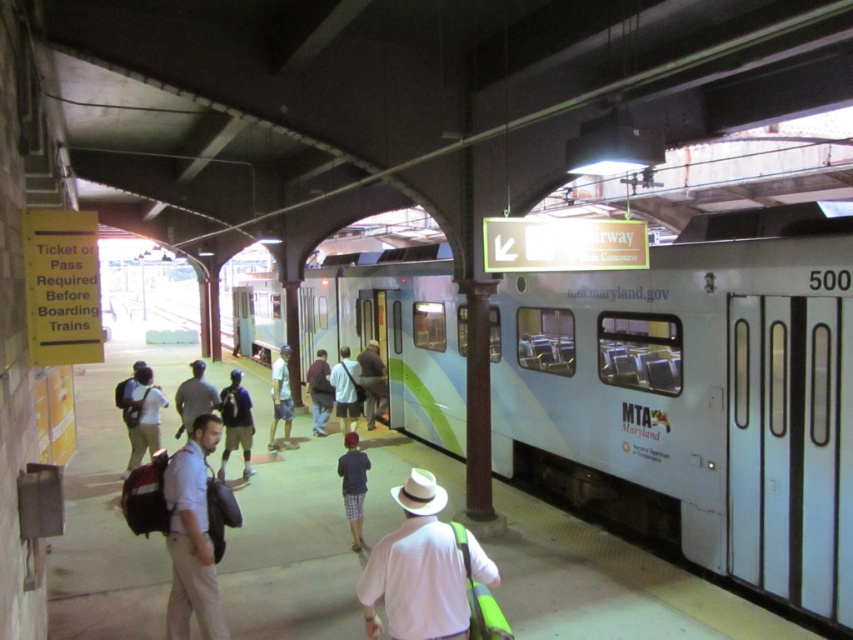
Question: Is dark gray shirt at center below dark brown leather jacket at center?

Choices:
 (A) yes
 (B) no

Answer: (A)

Question: Estimate the real-world distances between objects in this image. Which object is farther from the white matte shirt at center?

Choices:
 (A) dark gray shirt at center
 (B) dark brown leather jacket at center
 (C) dark blue shirt at center

Answer: (B)

Question: Which point is farther to the camera?

Choices:
 (A) (386, 557)
 (B) (364, 461)
 (C) (775, 492)

Answer: (B)

Question: Which object is the farthest from the white cotton shirt at center?

Choices:
 (A) dark brown leather jacket at center
 (B) dark brown backpack at center
 (C) light blue shirt at center

Answer: (A)

Question: Is light beige pants at center below dark brown leather jacket at center?

Choices:
 (A) no
 (B) yes

Answer: (B)

Question: Does dark gray shirt at center appear on the right side of light blue shirt at center?

Choices:
 (A) no
 (B) yes

Answer: (A)